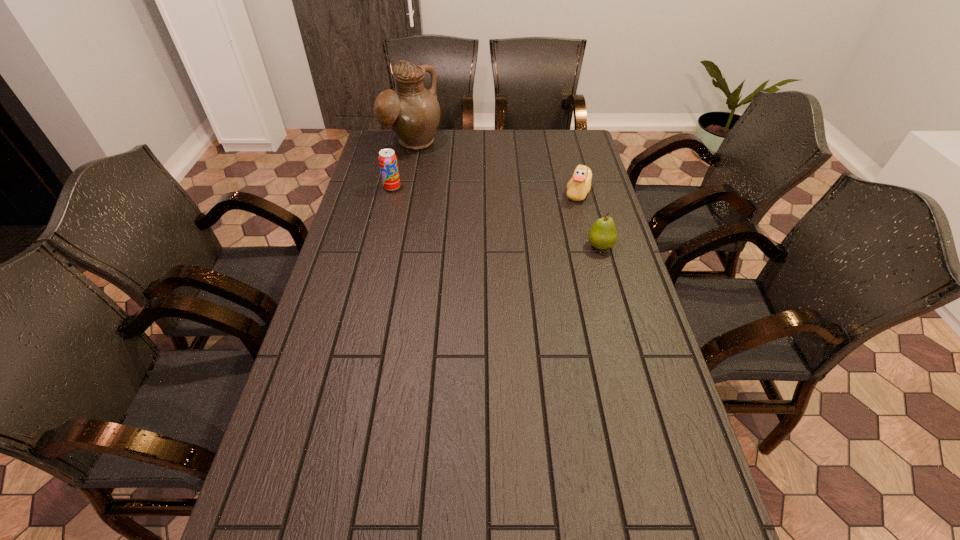
Find the location of a particular element. The width and height of the screenshot is (960, 540). free space at the left edge of the desktop is located at coordinates (299, 428).

The image size is (960, 540). I want to click on vacant area at the right edge of the desktop, so click(592, 201).

The image size is (960, 540). In the image, there is a desktop. Identify the location of free space at the far left corner. (376, 157).

Find the location of a particular element. Image resolution: width=960 pixels, height=540 pixels. free region at the near left corner of the desktop is located at coordinates (261, 523).

This screenshot has height=540, width=960. In order to click on unoccupied area between the soda can and the nearest object in this screenshot , I will do `click(496, 217)`.

In order to click on free space between the soda can and the nearest object in this screenshot , I will do `click(496, 217)`.

This screenshot has width=960, height=540. In order to click on empty location between the duck and the pitcher in this screenshot , I will do (495, 168).

What are the coordinates of `free space between the duck and the farthest object` in the screenshot? It's located at (495, 168).

The height and width of the screenshot is (540, 960). Find the location of `vacant space in between the duck and the soda can`. vacant space in between the duck and the soda can is located at coordinates (485, 190).

Identify the location of free point between the soda can and the tallest object. The width and height of the screenshot is (960, 540). (402, 166).